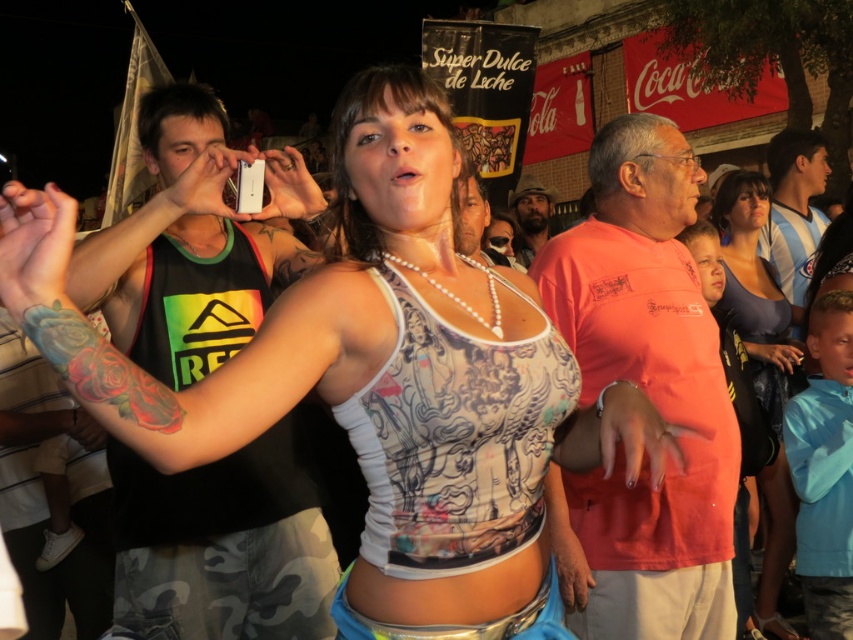
You are a photographer at a festival and want to capture both the blue and white striped shirt at right and the beige fabric hat at upper center in the same frame. Which object should you adjust your camera to focus on first to ensure both are in the shot?

You should focus on the beige fabric hat at upper center first because the blue and white striped shirt at right is to the right of it, so adjusting the frame to include the hat will naturally include the shirt on its right side.

You are a photographer at the event and want to capture both the orange cotton shirt at center and the matte blue tank top at center in the same frame. Since you want to highlight the height difference between them, which one should you position closer to the bottom of the frame?

The orange cotton shirt at center is taller than the matte blue tank top at center, so to emphasize their height difference, position the orange cotton shirt at center closer to the bottom of the frame so it appears larger, while placing the matte blue tank top at center higher up to make it look smaller.

You are a photographer at the event and need to choose between two outfits for a closeup shot. The matte blue tank top at center and the blue and white striped shirt at right. Which one would you pick if you want the outfit to appear more slimming?

The matte blue tank top at center is thinner than the blue and white striped shirt at right, so it would be the better choice for a slimming effect.